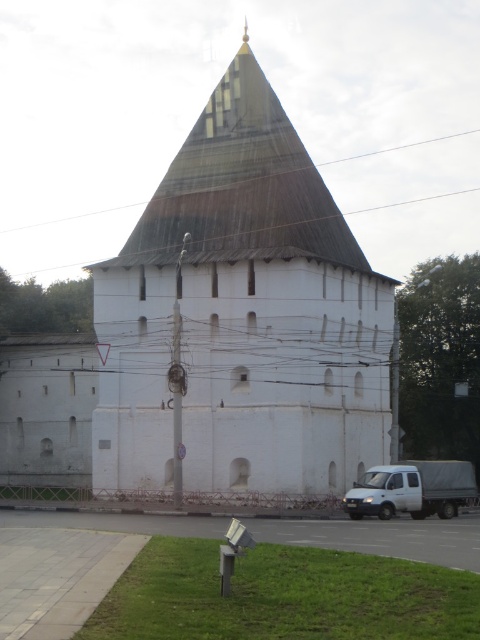
You are a photographer planning to take a picture of the white stone chapel at center and the brown wooden power line at upper center. Based on their sizes in the image, which one would appear larger in your photo?

The white stone chapel at center appears larger in the photo because it is much taller than the brown wooden power line at upper center.

From the picture: You are a delivery driver who needs to park your white matte truck at lower right as close as possible to the white stone chapel at center without blocking the paved area in front of it. Can you park the truck on the same side as the chapel?

The white stone chapel at center is positioned on the left side of white matte truck at lower right. Therefore, you can park the white matte truck at lower right on the same side as the chapel without blocking the paved area.